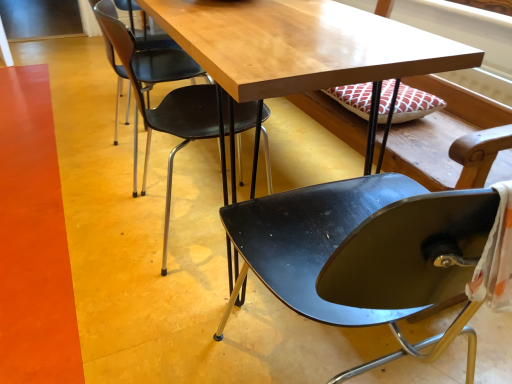
The image size is (512, 384). What are the coordinates of `vacant area situated to the left side of black plastic chair at upper center, acting as the 1th chair starting from the left` in the screenshot? It's located at (92, 218).